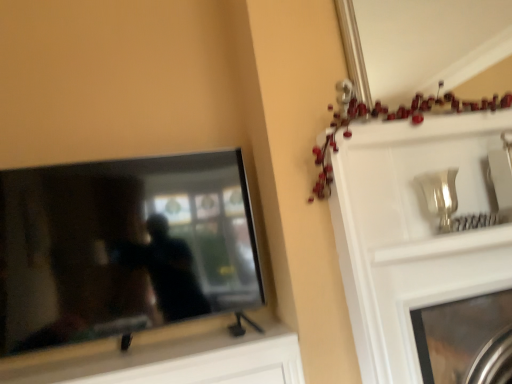
Describe the element at coordinates (429, 43) in the screenshot. I see `metallic silver mirror at upper center` at that location.

Where is `metallic garland at upper right`? The height and width of the screenshot is (384, 512). metallic garland at upper right is located at coordinates (389, 120).

This screenshot has width=512, height=384. Find the location of `matte black tv at left`. matte black tv at left is located at coordinates (123, 247).

Locate an element on the screen. Image resolution: width=512 pixels, height=384 pixels. television on the left of metallic silver fireplace at upper right is located at coordinates (123, 247).

Looking at the image, does matte black tv at left seem bigger or smaller compared to metallic silver fireplace at upper right?

matte black tv at left is smaller than metallic silver fireplace at upper right.

Is matte black tv at left at the right side of metallic silver fireplace at upper right?

No, matte black tv at left is not to the right of metallic silver fireplace at upper right.

Is matte black tv at left looking in the opposite direction of metallic silver fireplace at upper right?

No, matte black tv at left is not facing away from metallic silver fireplace at upper right.

Between metallic silver fireplace at upper right and matte black tv at left, which one is positioned in front?

matte black tv at left is more forward.

Does metallic silver fireplace at upper right have a lesser height compared to matte black tv at left?

Indeed, metallic silver fireplace at upper right has a lesser height compared to matte black tv at left.

Which is behind, point (474, 312) or point (209, 160)?

The point (209, 160) is more distant.

Consider the image. Which object is wider, metallic silver fireplace at upper right or matte black tv at left?

metallic silver fireplace at upper right.

Are metallic garland at upper right and metallic silver fireplace at upper right far apart?

No, metallic garland at upper right is in close proximity to metallic silver fireplace at upper right.

Which is closer, (460, 108) or (461, 380)?

Point (460, 108) appears to be farther away from the viewer than point (461, 380).

Which is in front, metallic garland at upper right or metallic silver fireplace at upper right?

metallic garland at upper right is in front.

Consider the image. How many degrees apart are the facing directions of metallic garland at upper right and metallic silver fireplace at upper right?

metallic garland at upper right and metallic silver fireplace at upper right are facing 1.17 degrees away from each other.

In the scene shown: Is metallic garland at upper right in front of or behind metallic silver mirror at upper center in the image?

In the image, metallic garland at upper right appears in front of metallic silver mirror at upper center.

From a real-world perspective, is metallic garland at upper right positioned under metallic silver mirror at upper center based on gravity?

Yes, from a real-world perspective, metallic garland at upper right is under metallic silver mirror at upper center.

Is metallic garland at upper right with metallic silver mirror at upper center?

metallic garland at upper right is not next to metallic silver mirror at upper center, and they're not touching.

From a real-world perspective, is metallic silver fireplace at upper right positioned over metallic silver mirror at upper center based on gravity?

No.

Does point (433, 381) come closer to viewer compared to point (416, 73)?

Yes.

Which object is wider, metallic silver fireplace at upper right or metallic silver mirror at upper center?

metallic silver fireplace at upper right.

From the image's perspective, between metallic silver mirror at upper center and matte black tv at left, who is located below?

matte black tv at left, from the image's perspective.

Could you tell me if metallic silver mirror at upper center is turned towards matte black tv at left?

No, metallic silver mirror at upper center is not facing towards matte black tv at left.

From a real-world perspective, which object stands above the other?

metallic silver mirror at upper center.

From the picture: Is metallic silver mirror at upper center situated inside matte black tv at left or outside?

metallic silver mirror at upper center cannot be found inside matte black tv at left.

Which object is closer to the camera taking this photo, metallic silver mirror at upper center or metallic garland at upper right?

metallic garland at upper right.

Consider the image. Could metallic garland at upper right be considered to be inside metallic silver mirror at upper center?

No.

From a real-world perspective, which object rests below the other?

metallic garland at upper right.

Which is closer, (x=367, y=21) or (x=423, y=110)?

Point (x=423, y=110)

Where is `fireplace that appears below the matte black tv at left (from the image's perspective)`? The image size is (512, 384). fireplace that appears below the matte black tv at left (from the image's perspective) is located at coordinates (457, 334).

The height and width of the screenshot is (384, 512). I want to click on fireplace below the matte black tv at left (from a real-world perspective), so click(x=457, y=334).

When comparing their distances from metallic garland at upper right, does metallic silver mirror at upper center or matte black tv at left seem further?

Based on the image, metallic silver mirror at upper center appears to be further to metallic garland at upper right.

From the image, which object appears to be nearer to metallic silver mirror at upper center, matte black tv at left or metallic garland at upper right?

metallic garland at upper right.

Estimate the real-world distances between objects in this image. Which object is closer to metallic silver fireplace at upper right, metallic garland at upper right or metallic silver mirror at upper center?

metallic garland at upper right is positioned closer to the anchor metallic silver fireplace at upper right.

When comparing their distances from metallic silver mirror at upper center, does metallic silver fireplace at upper right or matte black tv at left seem closer?

matte black tv at left is closer to metallic silver mirror at upper center.

Based on their spatial positions, is metallic silver mirror at upper center or matte black tv at left closer to metallic silver fireplace at upper right?

matte black tv at left.

When comparing their distances from metallic garland at upper right, does metallic silver mirror at upper center or metallic silver fireplace at upper right seem further?

metallic silver mirror at upper center is further to metallic garland at upper right.

Estimate the real-world distances between objects in this image. Which object is further from matte black tv at left, metallic silver fireplace at upper right or metallic garland at upper right?

metallic silver fireplace at upper right is positioned further to the anchor matte black tv at left.

Estimate the real-world distances between objects in this image. Which object is further from matte black tv at left, metallic garland at upper right or metallic silver fireplace at upper right?

metallic silver fireplace at upper right lies further to matte black tv at left than the other object.

Locate an element on the screen. mirror between matte black tv at left and metallic silver fireplace at upper right is located at coordinates (429, 43).

The width and height of the screenshot is (512, 384). Identify the location of christmas decoration situated between matte black tv at left and metallic silver fireplace at upper right from left to right. (389, 120).

Identify the location of christmas decoration between metallic silver mirror at upper center and metallic silver fireplace at upper right in the vertical direction. (389, 120).

Find the location of a particular element. christmas decoration between matte black tv at left and metallic silver mirror at upper center is located at coordinates (389, 120).